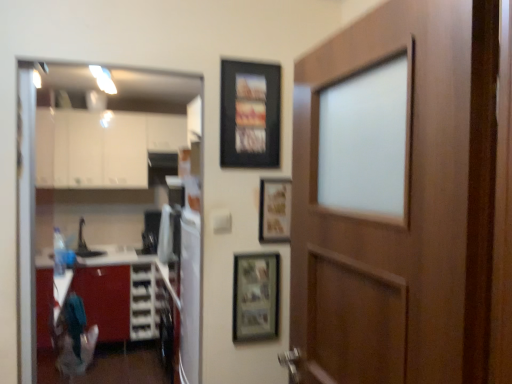
Question: Should I look upward or downward to see wooden door at right?

Choices:
 (A) up
 (B) down

Answer: (B)

Question: Is wooden-framed photo at center, marked as the first picture frame in a bottom-to-top arrangement, next to black matte picture frame at upper center, which is counted as the 1th picture frame, starting from the top, and touching it?

Choices:
 (A) no
 (B) yes

Answer: (A)

Question: Considering the relative sizes of wooden-framed photo at center, the third picture frame viewed from the top, and black matte picture frame at upper center, which is counted as the 1th picture frame, starting from the top, in the image provided, is wooden-framed photo at center, the third picture frame viewed from the top, smaller than black matte picture frame at upper center, which is counted as the 1th picture frame, starting from the top,?

Choices:
 (A) no
 (B) yes

Answer: (B)

Question: Does wooden-framed photo at center, the third picture frame viewed from the top, lie behind black matte picture frame at upper center, the third picture frame from the bottom?

Choices:
 (A) yes
 (B) no

Answer: (A)

Question: Is wooden-framed photo at center, the third picture frame viewed from the top, facing towards black matte picture frame at upper center, which is counted as the 1th picture frame, starting from the top?

Choices:
 (A) no
 (B) yes

Answer: (A)

Question: Is wooden-framed photo at center, marked as the first picture frame in a bottom-to-top arrangement, thinner than black matte picture frame at upper center, the third picture frame from the bottom?

Choices:
 (A) no
 (B) yes

Answer: (B)

Question: Can you confirm if wooden-framed photo at center, marked as the first picture frame in a bottom-to-top arrangement, is bigger than black matte picture frame at upper center, which is counted as the 1th picture frame, starting from the top?

Choices:
 (A) yes
 (B) no

Answer: (B)

Question: Can you confirm if wooden door at right is bigger than wooden-framed photo at center, the third picture frame viewed from the top?

Choices:
 (A) no
 (B) yes

Answer: (B)

Question: Does wooden door at right lie in front of wooden-framed photo at center, the third picture frame viewed from the top?

Choices:
 (A) no
 (B) yes

Answer: (B)

Question: Is wooden door at right at the right side of wooden-framed photo at center, the third picture frame viewed from the top?

Choices:
 (A) yes
 (B) no

Answer: (A)

Question: Can you confirm if wooden door at right is smaller than wooden-framed photo at center, marked as the first picture frame in a bottom-to-top arrangement?

Choices:
 (A) no
 (B) yes

Answer: (A)

Question: Is the position of wooden door at right more distant than that of wooden-framed photo at center, the third picture frame viewed from the top?

Choices:
 (A) yes
 (B) no

Answer: (B)

Question: Would you say wooden-framed photo at center, marked as the first picture frame in a bottom-to-top arrangement, is part of wooden door at right's contents?

Choices:
 (A) no
 (B) yes

Answer: (A)

Question: Considering the relative sizes of wooden-framed photo at center, the third picture frame viewed from the top, and wooden door at right in the image provided, is wooden-framed photo at center, the third picture frame viewed from the top, wider than wooden door at right?

Choices:
 (A) yes
 (B) no

Answer: (B)